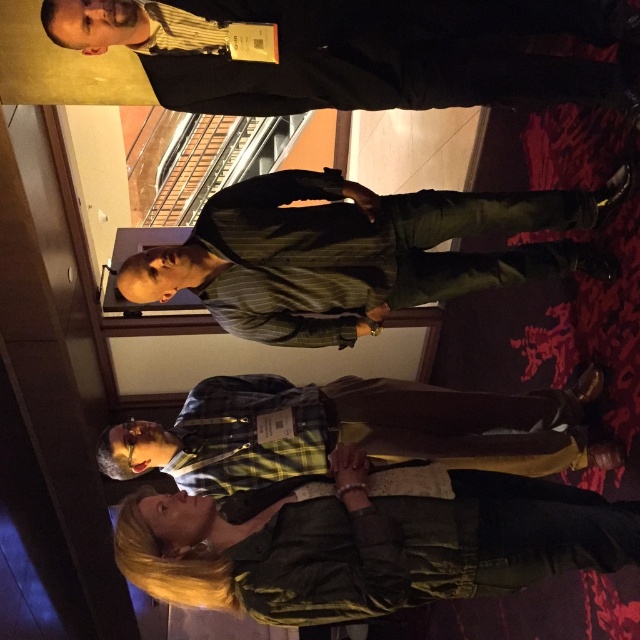
Is point (200, 531) positioned behind point (584, 200)?

No, (200, 531) is closer to viewer.

Describe the element at coordinates (368, 544) in the screenshot. This screenshot has width=640, height=640. I see `green textured jacket at lower center` at that location.

Between point (189, 573) and point (449, 276), which one is positioned behind?

The point (449, 276) is more distant.

Locate an element on the screen. The height and width of the screenshot is (640, 640). green textured jacket at lower center is located at coordinates (368, 544).

Is dark gray suit at upper center thinner than green striped shirt at center?

No, dark gray suit at upper center is not thinner than green striped shirt at center.

In the scene shown: Does dark gray suit at upper center appear on the right side of green striped shirt at center?

In fact, dark gray suit at upper center is to the left of green striped shirt at center.

Which is in front, point (218, 8) or point (250, 321)?

Point (218, 8) is more forward.

Locate an element on the screen. dark gray suit at upper center is located at coordinates (362, 51).

Does green textured jacket at lower center have a larger size compared to dark gray suit at upper center?

Incorrect, green textured jacket at lower center is not larger than dark gray suit at upper center.

What do you see at coordinates (368, 544) in the screenshot? I see `green textured jacket at lower center` at bounding box center [368, 544].

Locate an element on the screen. Image resolution: width=640 pixels, height=640 pixels. green textured jacket at lower center is located at coordinates (368, 544).